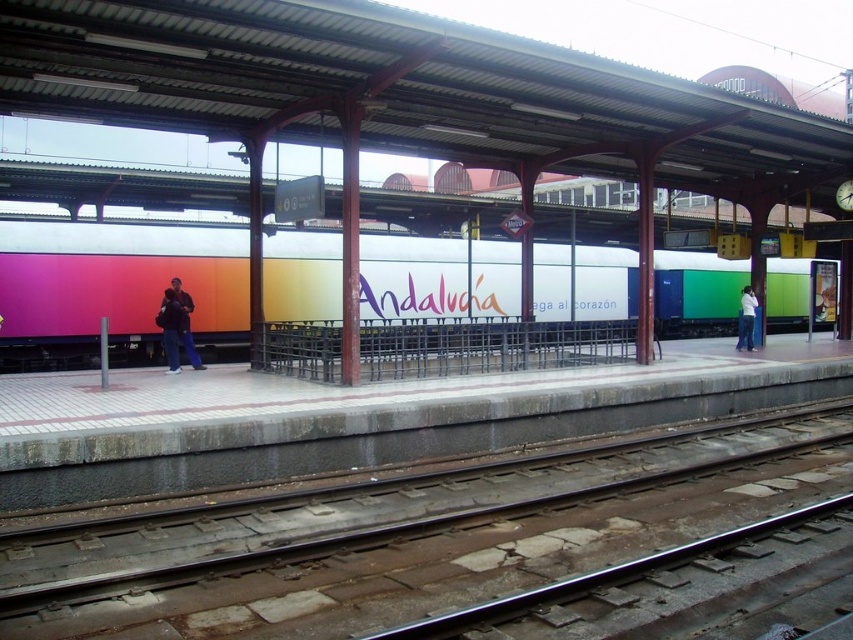
Question: Is concrete platform at center below jeans at right?

Choices:
 (A) yes
 (B) no

Answer: (A)

Question: Is metal at center to the left of concrete platform at center from the viewer's perspective?

Choices:
 (A) yes
 (B) no

Answer: (B)

Question: Which of these objects is positioned farthest from the rainbow gradient billboard at center?

Choices:
 (A) dark blue jeans at center
 (B) blue jeans at center
 (C) metal at center

Answer: (C)

Question: Among these points, which one is farthest from the camera?

Choices:
 (A) (207, 292)
 (B) (161, 300)
 (C) (466, 508)

Answer: (A)

Question: From the image, what is the correct spatial relationship of blue jeans at center in relation to jeans at right?

Choices:
 (A) right
 (B) left

Answer: (B)

Question: Which point is closer to the camera?

Choices:
 (A) rainbow gradient billboard at center
 (B) dark blue jeans at center
 (C) blue jeans at center

Answer: (C)